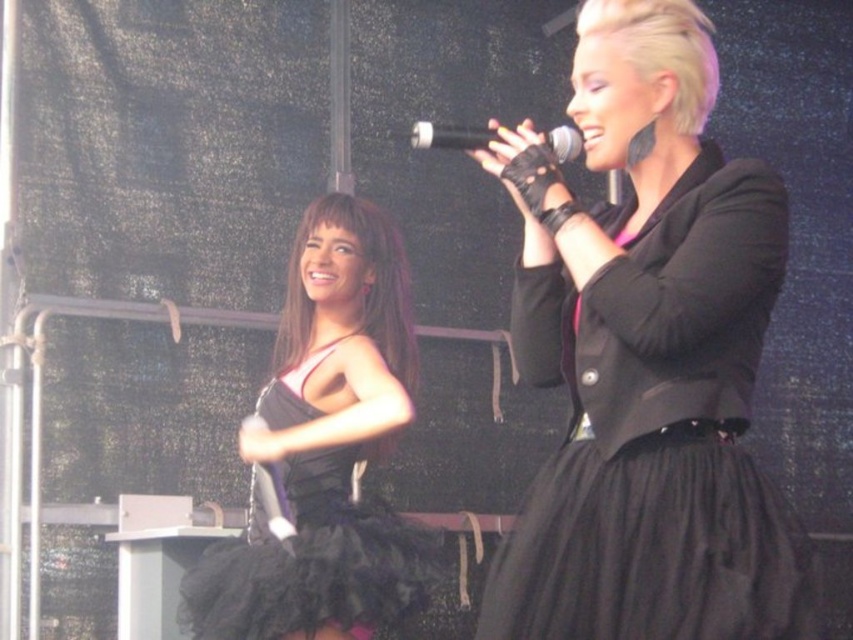
Is point (779, 253) less distant than point (451, 131)?

Yes, point (779, 253) is in front of point (451, 131).

Does black tulle dress at upper right appear over black matte microphone at upper center?

Actually, black tulle dress at upper right is below black matte microphone at upper center.

At what (x,y) coordinates should I click in order to perform the action: click on black tulle dress at upper right. Please return your answer as a coordinate pair (x, y). Looking at the image, I should click on (659, 433).

Who is higher up, black tulle dress at left or black matte microphone at upper center?

black matte microphone at upper center

Between point (276, 403) and point (561, 157), which one is positioned behind?

Positioned behind is point (276, 403).

Is point (299, 452) farther from camera compared to point (577, 150)?

Yes, it is.

This screenshot has width=853, height=640. Identify the location of black tulle dress at left. (312, 561).

Between black tulle dress at upper right and black tulle dress at left, which one is positioned lower?

black tulle dress at left

Is point (782, 614) in front of point (238, 589)?

Yes, it is.

Between point (663, 248) and point (300, 580), which one is positioned in front?

Point (663, 248)

Locate an element on the screen. The height and width of the screenshot is (640, 853). black tulle dress at upper right is located at coordinates (659, 433).